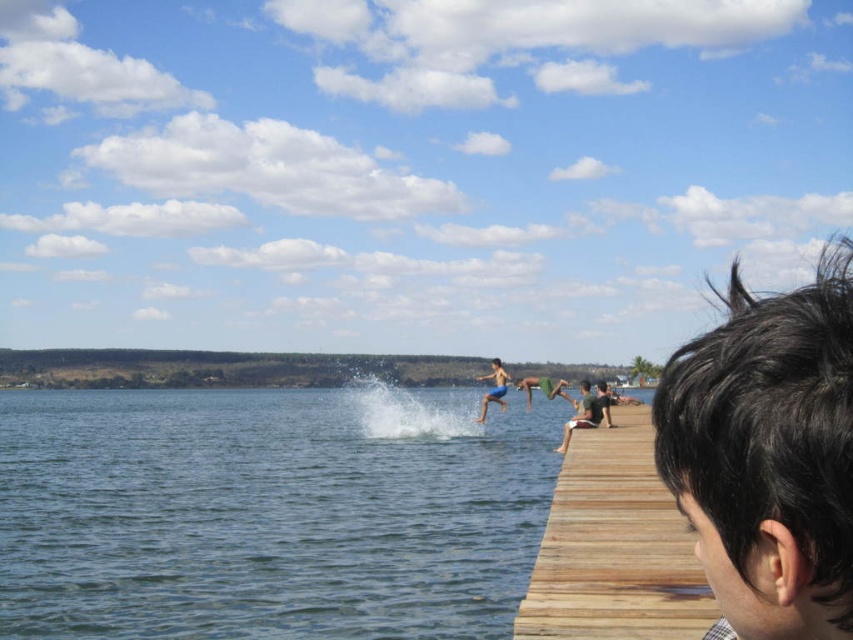
Based on the photo, between dark brown hair at right and wooden dock at right, which one appears on the left side from the viewer's perspective?

Positioned to the left is dark brown hair at right.

Is dark brown hair at right closer to the viewer compared to wooden dock at right?

Yes, it is in front of wooden dock at right.

Image resolution: width=853 pixels, height=640 pixels. Identify the location of dark brown hair at right. (769, 452).

The width and height of the screenshot is (853, 640). What are the coordinates of `dark brown hair at right` in the screenshot? It's located at (769, 452).

How distant is dark brown hair at right from blue fabric shorts at center?

dark brown hair at right and blue fabric shorts at center are 38.23 meters apart from each other.

Where is `dark brown hair at right`? This screenshot has width=853, height=640. dark brown hair at right is located at coordinates (x=769, y=452).

The height and width of the screenshot is (640, 853). Find the location of `dark brown hair at right`. dark brown hair at right is located at coordinates (769, 452).

Is clear blue water at center in front of wooden dock at right?

No, clear blue water at center is further to the viewer.

Between point (476, 544) and point (634, 620), which one is positioned in front?

Point (634, 620) is more forward.

This screenshot has height=640, width=853. I want to click on clear blue water at center, so click(270, 513).

The width and height of the screenshot is (853, 640). Identify the location of clear blue water at center. 270,513.